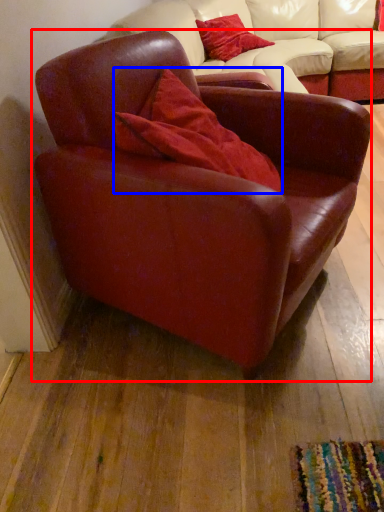
Question: Among these objects, which one is farthest to the camera, chair (highlighted by a red box) or pillow (highlighted by a blue box)?

Choices:
 (A) chair
 (B) pillow

Answer: (B)